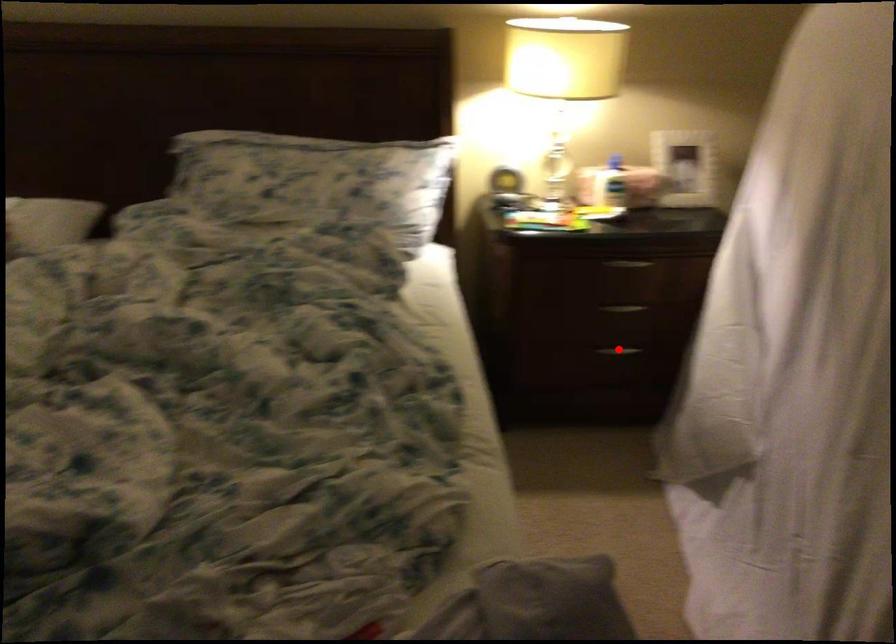
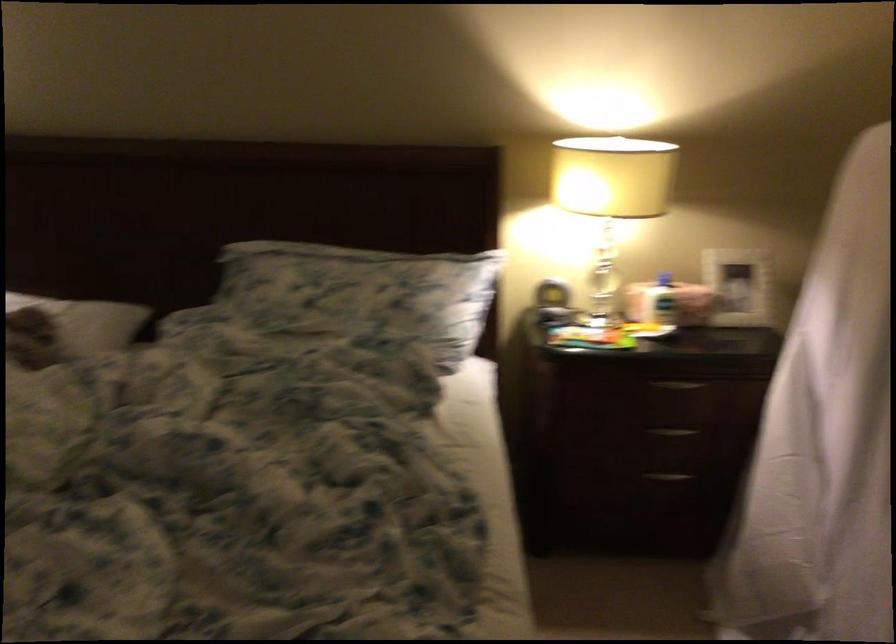
Locate, in the second image, the point that corresponds to the highlighted location in the first image.

(668, 476)